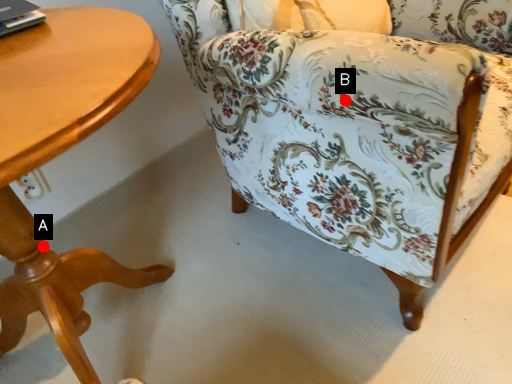
Question: Two points are circled on the image, labeled by A and B beside each circle. Which point appears farthest from the camera in this image?

Choices:
 (A) A is further
 (B) B is further

Answer: (A)